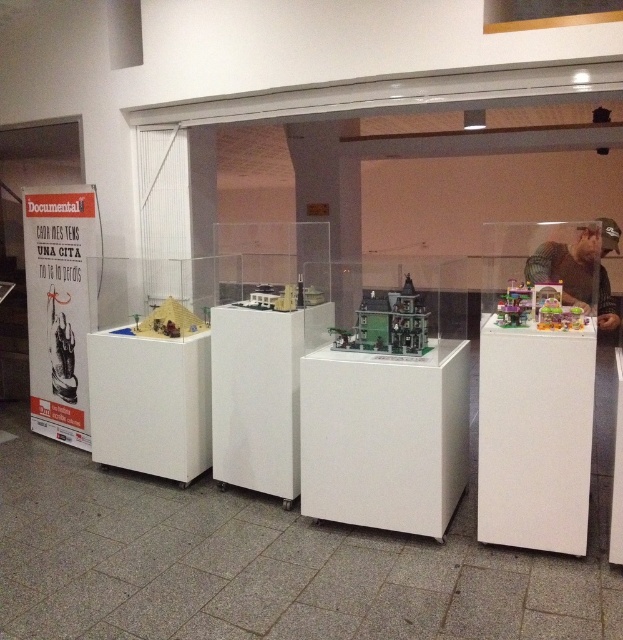
Is point (264, 392) in front of point (578, 237)?

Yes, point (264, 392) is closer to viewer.

Describe the element at coordinates (260, 392) in the screenshot. I see `white glossy display case at center` at that location.

Identify the location of white glossy display case at center. (260, 392).

The width and height of the screenshot is (623, 640). Find the location of `white glossy display case at center`. white glossy display case at center is located at coordinates (260, 392).